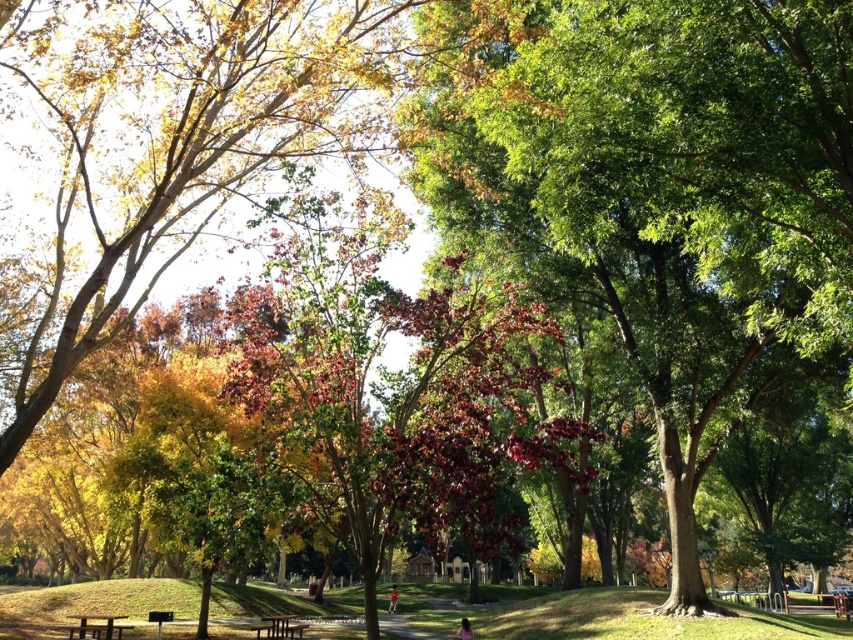
Which is behind, point (582, 634) or point (396, 598)?

The point (396, 598) is behind.

Who is lower down, green grass at lower center or red shirt at center?

red shirt at center

At what (x,y) coordinates should I click in order to perform the action: click on green grass at lower center. Please return your answer as a coordinate pair (x, y). This screenshot has height=640, width=853. Looking at the image, I should click on (610, 618).

Who is more distant from viewer, (254,612) or (469,630)?

The point (254,612) is behind.

Does point (753, 620) come in front of point (462, 618)?

Yes, point (753, 620) is in front of point (462, 618).

Is point (820, 621) in front of point (457, 628)?

That is False.

Find the location of a particular element. green grass at lower center is located at coordinates (610, 618).

Locate an element on the screen. pink fabric person at lower center is located at coordinates [463, 628].

Measure the distance from pink fabric person at lower center to red shirt at center.

The distance of pink fabric person at lower center from red shirt at center is 13.34 meters.

The image size is (853, 640). Find the location of `pink fabric person at lower center`. pink fabric person at lower center is located at coordinates (463, 628).